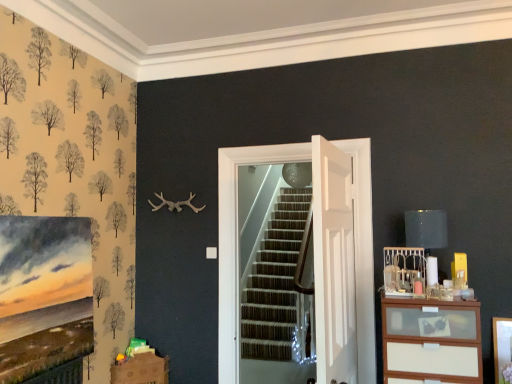
Question: Does brown cardboard drawer at lower left have a smaller size compared to white wood chest of drawers at right?

Choices:
 (A) no
 (B) yes

Answer: (B)

Question: From a real-world perspective, does brown cardboard drawer at lower left sit lower than white wood chest of drawers at right?

Choices:
 (A) no
 (B) yes

Answer: (B)

Question: Is brown cardboard drawer at lower left further to camera compared to white wood chest of drawers at right?

Choices:
 (A) yes
 (B) no

Answer: (A)

Question: Is brown cardboard drawer at lower left looking in the opposite direction of white wood chest of drawers at right?

Choices:
 (A) yes
 (B) no

Answer: (B)

Question: Considering the relative sizes of brown cardboard drawer at lower left and white wood chest of drawers at right in the image provided, is brown cardboard drawer at lower left wider than white wood chest of drawers at right?

Choices:
 (A) yes
 (B) no

Answer: (B)

Question: Looking at their shapes, would you say white wooden door at center, the first door from the back, is wider or thinner than matte black lampshade at upper right?

Choices:
 (A) thin
 (B) wide

Answer: (A)

Question: Relative to matte black lampshade at upper right, is white wooden door at center, which appears as the second door when viewed from the front, in front or behind?

Choices:
 (A) front
 (B) behind

Answer: (B)

Question: From a real-world perspective, is white wooden door at center, the first door from the back, physically located above or below matte black lampshade at upper right?

Choices:
 (A) below
 (B) above

Answer: (A)

Question: In terms of size, does white wooden door at center, which appears as the second door when viewed from the front, appear bigger or smaller than matte black lampshade at upper right?

Choices:
 (A) small
 (B) big

Answer: (B)

Question: Is point (432, 230) positioned closer to the camera than point (153, 357)?

Choices:
 (A) farther
 (B) closer

Answer: (B)

Question: From the image's perspective, is matte black lampshade at upper right above or below brown cardboard drawer at lower left?

Choices:
 (A) above
 (B) below

Answer: (A)

Question: Based on their positions, is matte black lampshade at upper right located to the left or right of brown cardboard drawer at lower left?

Choices:
 (A) left
 (B) right

Answer: (B)

Question: Is matte black lampshade at upper right wider or thinner than brown cardboard drawer at lower left?

Choices:
 (A) wide
 (B) thin

Answer: (B)

Question: In the image, is brown cardboard drawer at lower left positioned in front of or behind white wood chest of drawers at right?

Choices:
 (A) front
 (B) behind

Answer: (B)

Question: Is point (113, 377) positioned closer to the camera than point (428, 349)?

Choices:
 (A) closer
 (B) farther

Answer: (B)